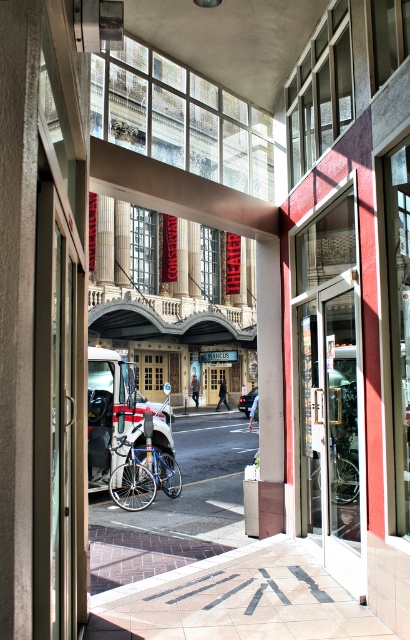
Who is taller, metallic pavement at center or silver metallic bicycle at center?

metallic pavement at center is taller.

Does metallic pavement at center appear on the left side of silver metallic bicycle at center?

Correct, you'll find metallic pavement at center to the left of silver metallic bicycle at center.

Where is `metallic pavement at center`? The height and width of the screenshot is (640, 410). metallic pavement at center is located at coordinates (198, 483).

This screenshot has height=640, width=410. I want to click on metallic pavement at center, so click(198, 483).

Does white matte car at center appear under silver metallic bicycle at center?

Correct, white matte car at center is located below silver metallic bicycle at center.

Between white matte car at center and silver metallic bicycle at center, which one has more height?

Standing taller between the two is white matte car at center.

Which is in front, point (113, 436) or point (330, 472)?

Positioned in front is point (330, 472).

Locate an element on the screen. white matte car at center is located at coordinates coord(109,410).

Locate an element on the screen. white matte car at center is located at coordinates (109, 410).

Does white matte car at center have a lesser width compared to black glossy car at center?

No, white matte car at center is not thinner than black glossy car at center.

Where is `white matte car at center`? white matte car at center is located at coordinates (109, 410).